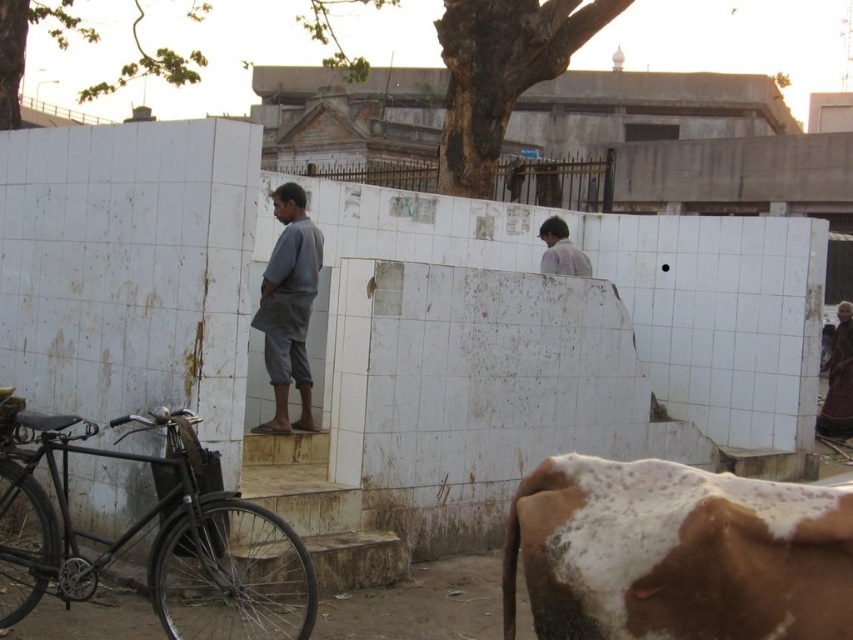
Can you confirm if brown speckled hide at lower right is taller than black matte bicycle at left?

No, brown speckled hide at lower right is not taller than black matte bicycle at left.

Does brown speckled hide at lower right appear on the right side of black matte bicycle at left?

Correct, you'll find brown speckled hide at lower right to the right of black matte bicycle at left.

Describe the element at coordinates (676, 554) in the screenshot. I see `brown speckled hide at lower right` at that location.

The width and height of the screenshot is (853, 640). What are the coordinates of `brown speckled hide at lower right` in the screenshot? It's located at (676, 554).

Between point (38, 497) and point (558, 234), which one is positioned behind?

The point (558, 234) is more distant.

Is point (201, 506) positioned before point (566, 257)?

Yes, point (201, 506) is in front of point (566, 257).

Between point (9, 508) and point (561, 224), which one is positioned in front?

Point (9, 508) is more forward.

Where is `black matte bicycle at left`? The width and height of the screenshot is (853, 640). black matte bicycle at left is located at coordinates (154, 536).

Measure the distance between point (570, 538) and camera.

Point (570, 538) and camera are 11.56 feet apart from each other.

Is brown speckled hide at lower right to the left of gray cotton kurta at center from the viewer's perspective?

In fact, brown speckled hide at lower right is to the right of gray cotton kurta at center.

Is point (728, 499) closer to camera compared to point (289, 323)?

Yes.

Image resolution: width=853 pixels, height=640 pixels. Identify the location of brown speckled hide at lower right. (676, 554).